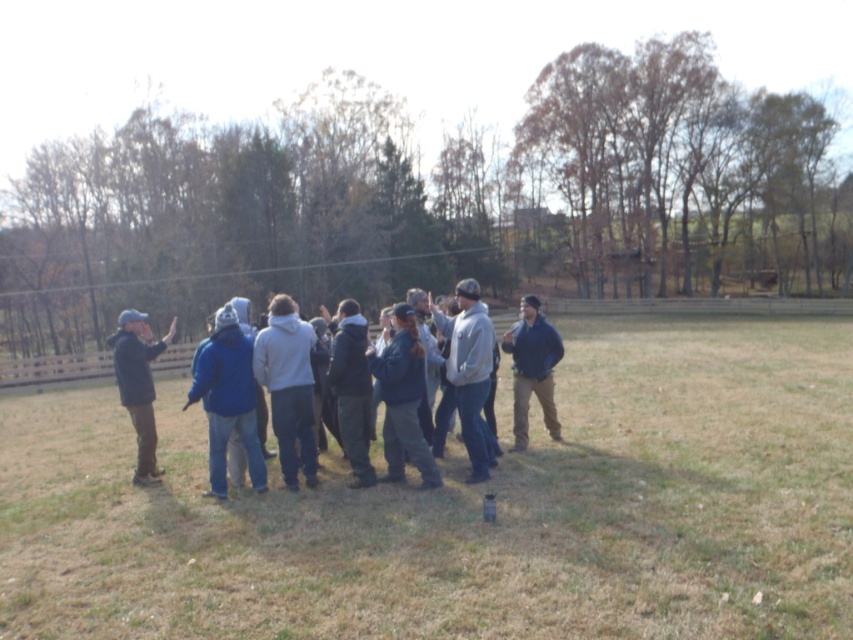
Based on the photo, you are a photographer trying to capture a group photo of the gray fleece jacket at center and the dark blue jacket at center. Since you want both jackets to appear in focus, you need to know their heights. Which jacket is taller?

The gray fleece jacket at center is taller than the dark blue jacket at center, so you should adjust your camera angle to ensure both are fully visible.